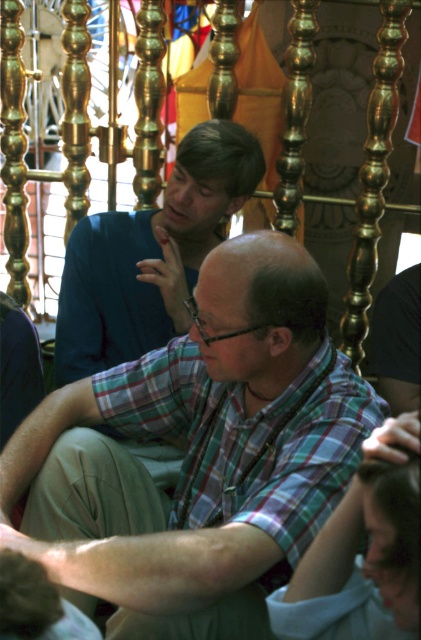
In the scene, there are two people wearing plaid shirts. The person in the foreground is wearing a plaid cotton shirt at center, and the other individual partially visible behind has a plaid shirt at center. Which plaid shirt is shorter in height?

The plaid cotton shirt at center has a lesser height compared to plaid shirt at center.

You are planning to take a photo of the two people wearing plaid cotton shirt at center and plaid shirt at center. Given that your camera has a maximum focus range of 20 feet, will you be able to capture both subjects in focus simultaneously?

The plaid cotton shirt at center and plaid shirt at center are 21.47 feet apart. Since the camera can only focus up to 20 feet, the distance between them exceeds the camera limit. Therefore, you cannot capture both in focus at the same time.